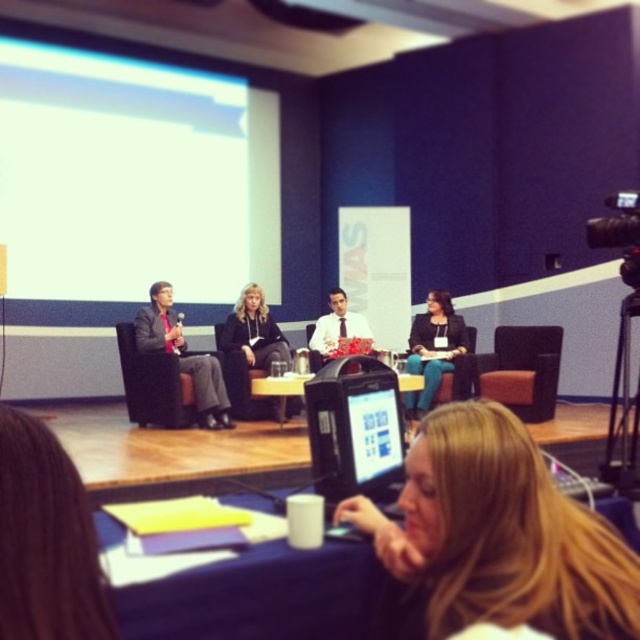
Question: Which of these objects is positioned closest to the matte black jacket at center?

Choices:
 (A) white matte projection screen at upper left
 (B) matte black suit at center
 (C) brown fabric chair at center
 (D) matte black laptop at center

Answer: (C)

Question: Is matte black jacket at center in front of matte black laptop at center?

Choices:
 (A) no
 (B) yes

Answer: (A)

Question: Estimate the real-world distances between objects in this image. Which object is closer to the matte black jacket at center?

Choices:
 (A) white matte projection screen at upper left
 (B) brown fabric chair at center

Answer: (B)

Question: Is black fleece jacket at center wider than matte black laptop at center?

Choices:
 (A) yes
 (B) no

Answer: (A)

Question: Which point is closer to the camera?

Choices:
 (A) matte black laptop at center
 (B) matte black jacket at center
 (C) blue fabric table at lower center

Answer: (C)

Question: Does white matte projection screen at upper left appear over matte black laptop at center?

Choices:
 (A) yes
 (B) no

Answer: (A)